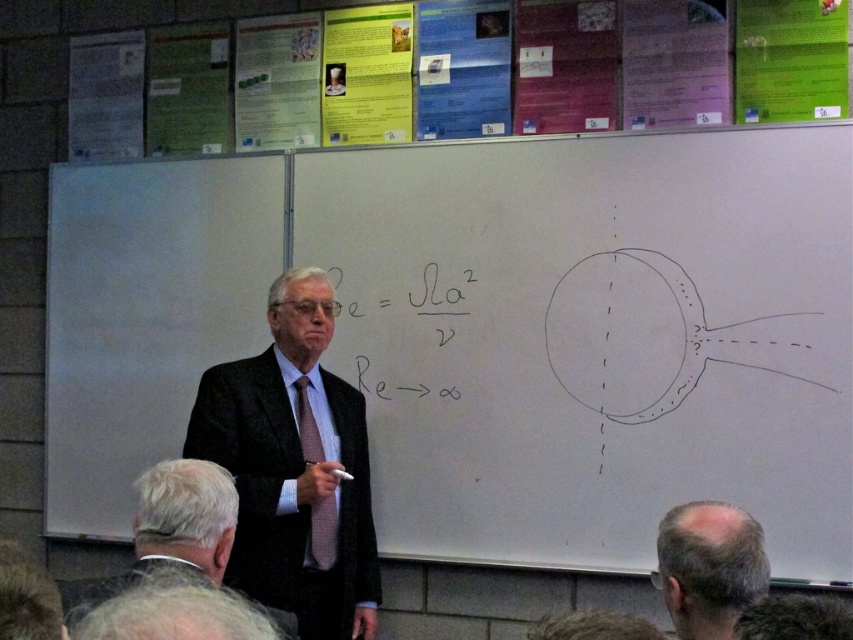
You are a student sitting in the classroom. You notice the dark suit at center and the black matte equation at center on the whiteboard. Which object is bigger in size?

The dark suit at center has a larger size compared to the black matte equation at center.